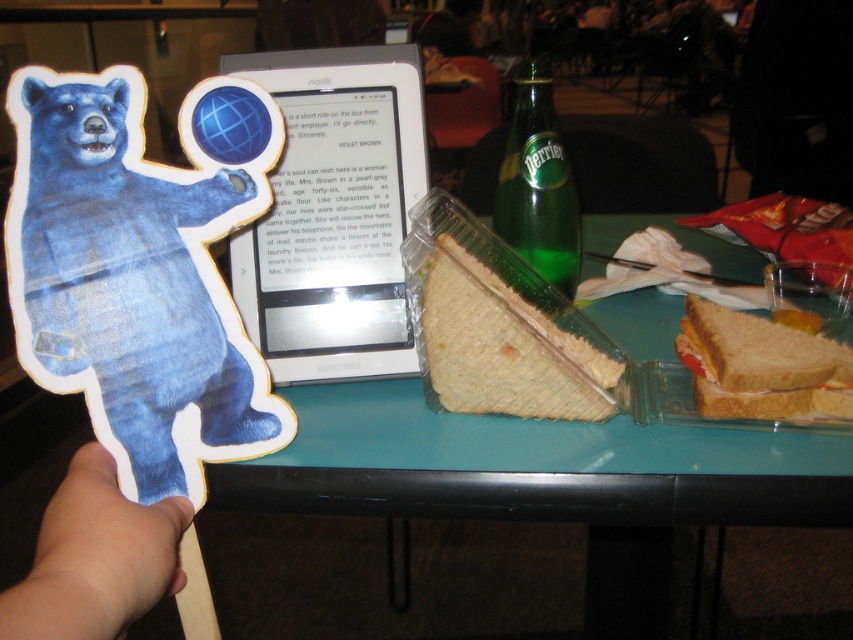
You are taking a photo of the dining table and want to focus on both point (30, 173) and point (738, 387). Which point should you adjust your focus to first to ensure it is sharp in the photo?

You should focus on point (30, 173) first because it is closer to the camera and will be in focus before the point (738, 387) which is further away.